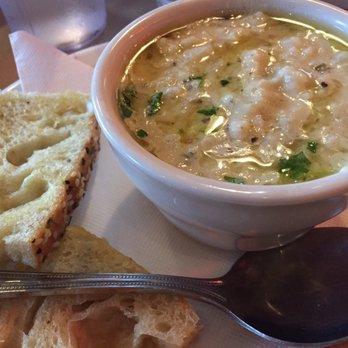
Where is `bowl of spoon`? The width and height of the screenshot is (348, 348). bowl of spoon is located at coordinates (310, 288).